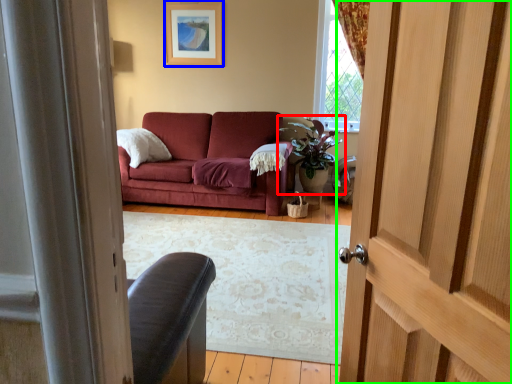
Question: Which object is the farthest from houseplant (highlighted by a red box)? Choose among these: picture frame (highlighted by a blue box) or door (highlighted by a green box).

Choices:
 (A) picture frame
 (B) door

Answer: (B)